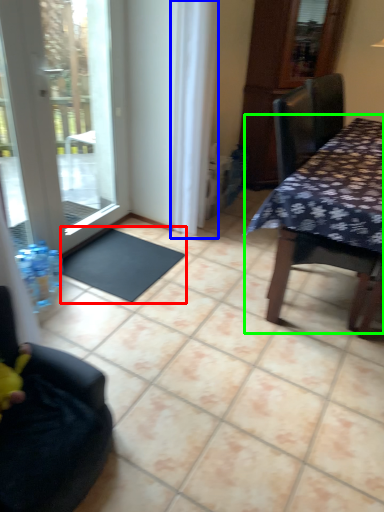
Question: Estimate the real-world distances between objects in this image. Which object is farther from doormat (highlighted by a red box), curtain (highlighted by a blue box) or table (highlighted by a green box)?

Choices:
 (A) curtain
 (B) table

Answer: (B)